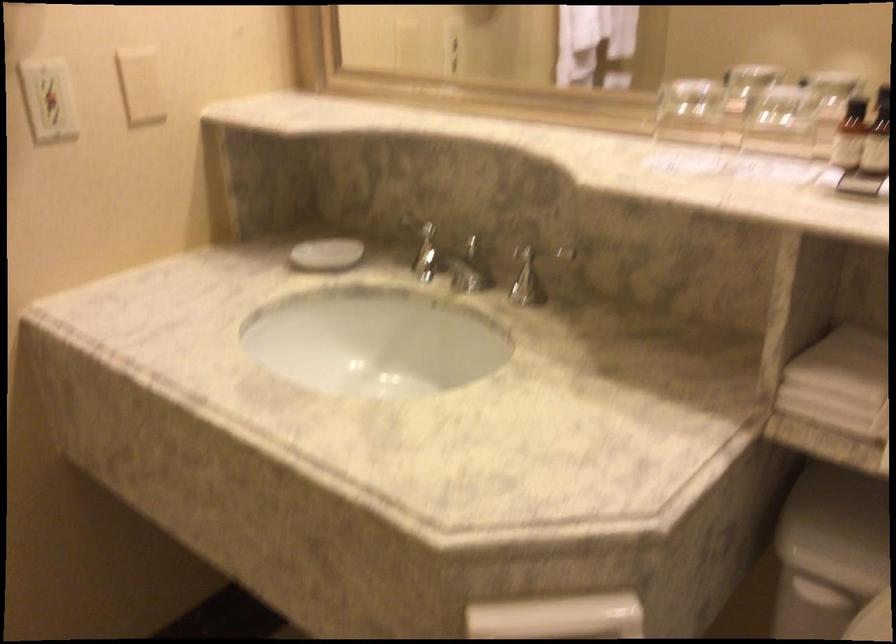
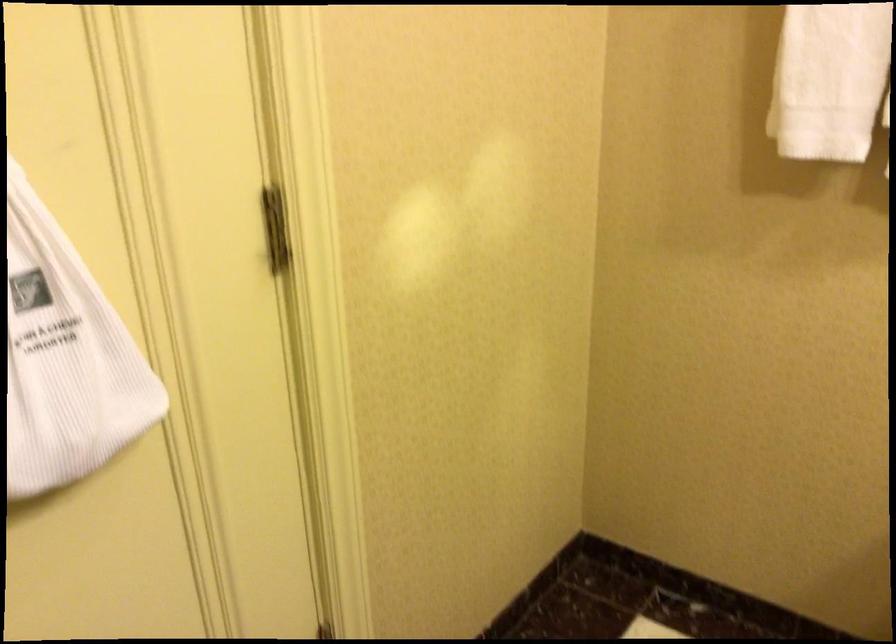
How did the camera likely rotate?

The camera rotated toward left-down.